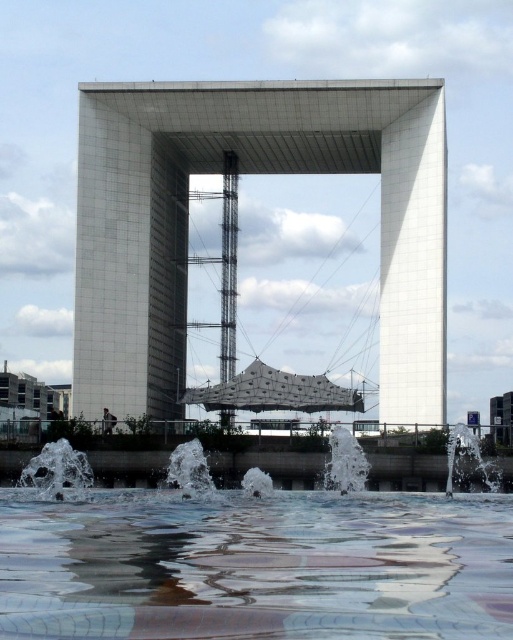
Question: Which object is farther from the camera taking this photo?

Choices:
 (A) clear glass water at center
 (B) white concrete structure at center
 (C) white smooth pillar at right

Answer: (B)

Question: Considering the real-world distances, which object is closest to the clear water at lower left?

Choices:
 (A) clear water at lower right
 (B) white concrete structure at center
 (C) white frothy water at center
 (D) white smooth pillar at right

Answer: (C)

Question: Considering the relative positions of clear glass water at center and white frothy water at center in the image provided, where is clear glass water at center located with respect to white frothy water at center?

Choices:
 (A) below
 (B) above

Answer: (A)

Question: Is clear water at lower left smaller than white frothy water at center?

Choices:
 (A) yes
 (B) no

Answer: (B)

Question: Is white concrete structure at center further to the viewer compared to clear water at lower left?

Choices:
 (A) yes
 (B) no

Answer: (A)

Question: Which object is farther from the camera taking this photo?

Choices:
 (A) clear water at lower right
 (B) clear water at lower left
 (C) white concrete structure at center

Answer: (C)